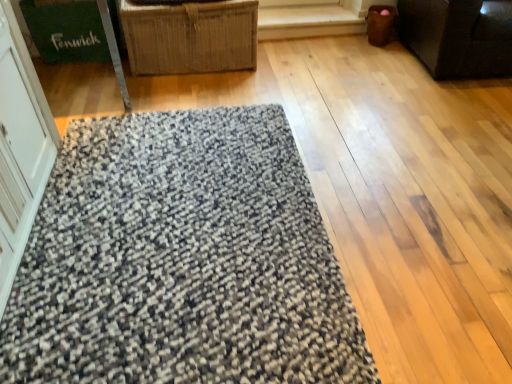
Image resolution: width=512 pixels, height=384 pixels. I want to click on vacant area that is in front of woven straw basket at upper center, which ranks as the second furniture in right-to-left order, so click(190, 101).